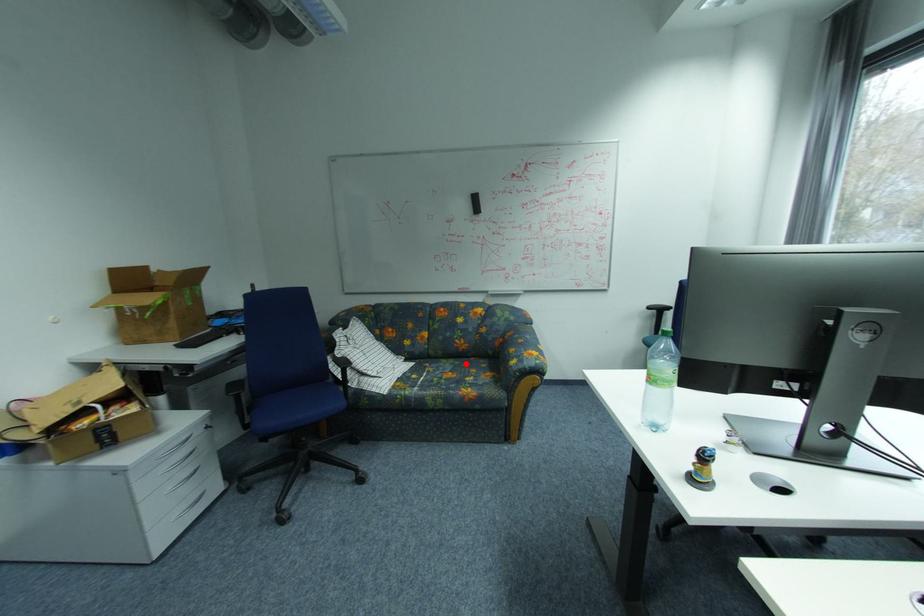
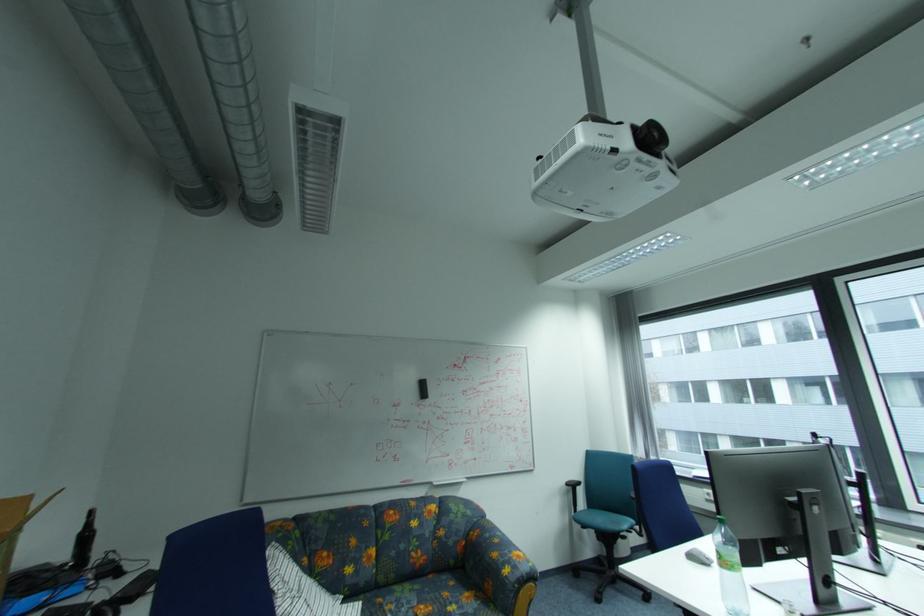
Question: A red point is marked in image1. In image2, is the corresponding 3D point closer to the camera or farther? Reply with the corresponding letter.

Choices:
 (A) The corresponding 3D point is closer.
 (B) The corresponding 3D point is farther.

Answer: (A)